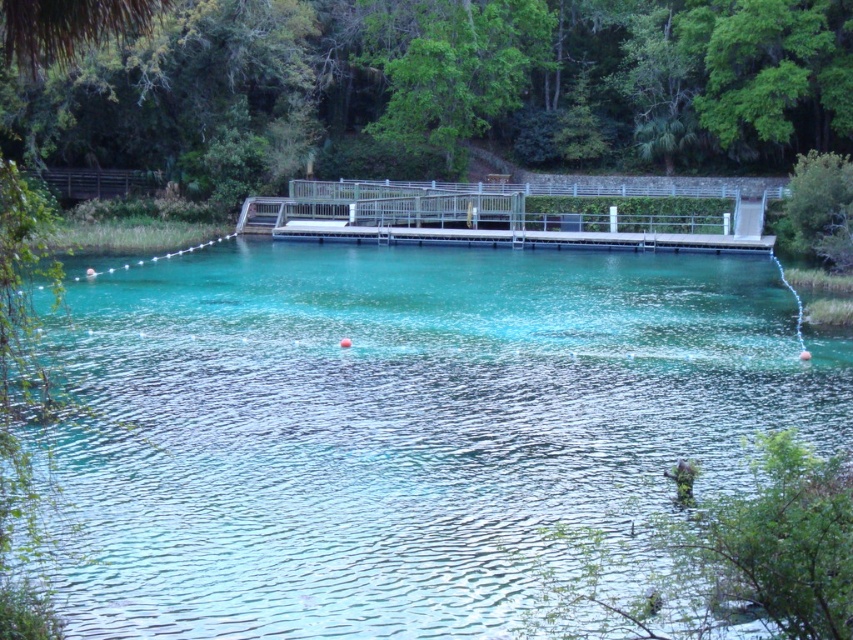
Does point (368, 634) lie behind point (608, 208)?

No, (368, 634) is in front of (608, 208).

Is point (97, 481) behind point (525, 234)?

No, (97, 481) is in front of (525, 234).

The height and width of the screenshot is (640, 853). I want to click on clear water at center, so click(x=393, y=426).